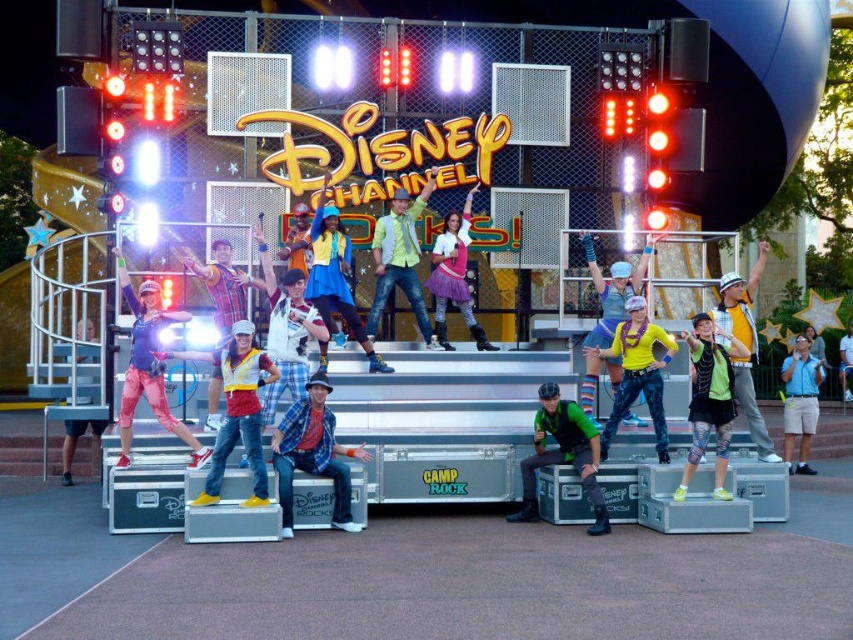
Who is lower down, light blue denim shorts at lower right or matte black pants at lower left?

light blue denim shorts at lower right is lower down.

This screenshot has height=640, width=853. In order to click on light blue denim shorts at lower right in this screenshot , I will do `click(799, 403)`.

Is point (786, 460) behind point (68, 445)?

Yes.

Locate an element on the screen. This screenshot has height=640, width=853. light blue denim shorts at lower right is located at coordinates 799,403.

Who is more distant from viewer, (711, 378) or (445, 333)?

Point (445, 333)

Is green matte vest at center bigger than pink satin skirt at center?

No, green matte vest at center is not bigger than pink satin skirt at center.

Is point (693, 340) positioned before point (438, 253)?

Yes, point (693, 340) is in front of point (438, 253).

The image size is (853, 640). I want to click on green matte vest at center, so click(x=709, y=401).

Does pink satin skirt at center have a greater width compared to light blue denim shorts at lower right?

No, pink satin skirt at center is not wider than light blue denim shorts at lower right.

Find the location of `pink satin skirt at center`. pink satin skirt at center is located at coordinates (454, 275).

This screenshot has width=853, height=640. I want to click on pink satin skirt at center, so click(x=454, y=275).